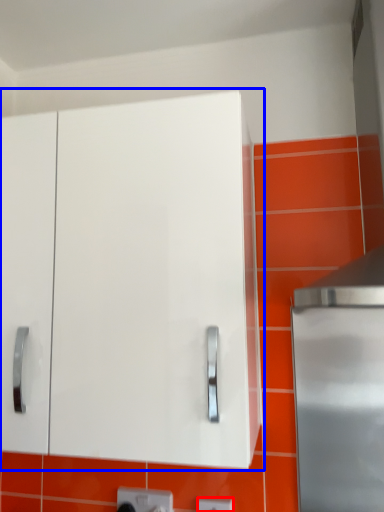
Question: Which object appears closest to the camera in this image, electric outlet (highlighted by a red box) or cabinetry (highlighted by a blue box)?

Choices:
 (A) electric outlet
 (B) cabinetry

Answer: (B)